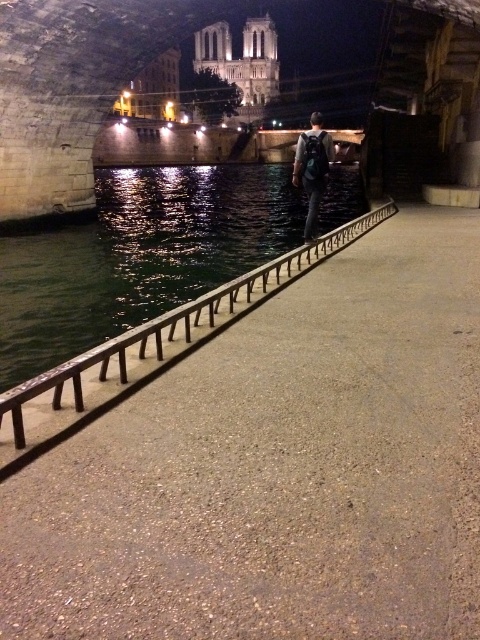
You are a tourist walking along the river path and want to place your dark blue backpack at center on the ground next to the black metal rail at center. Can you fit both items side by side without overlapping?

The black metal rail at center has a smaller size compared to dark blue backpack at center. Since the rail is smaller, there should be enough space to place both items side by side without overlapping.